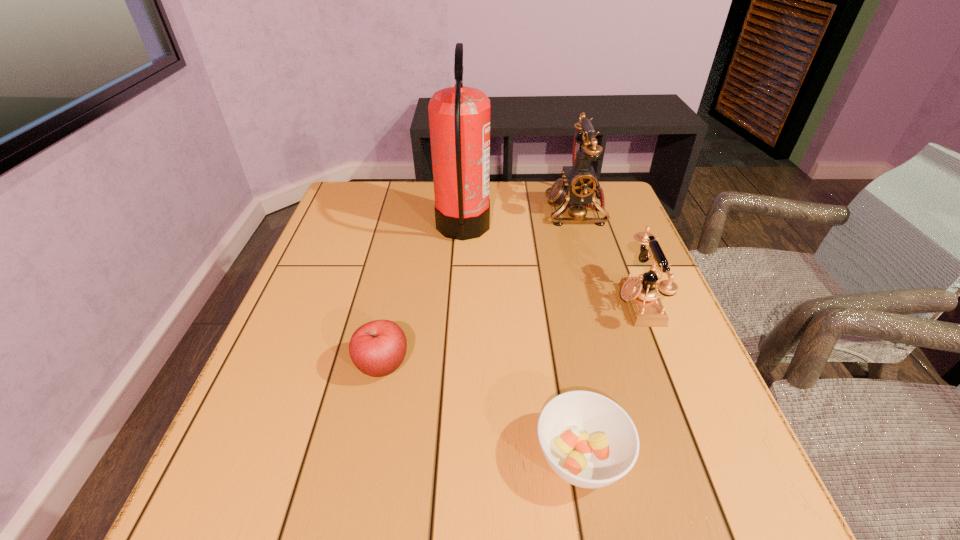
Identify the location of vacant area that lies between the apple and the tallest object. (422, 297).

The width and height of the screenshot is (960, 540). I want to click on unoccupied position between the fire extinguisher and the shortest object, so click(x=522, y=342).

This screenshot has width=960, height=540. I want to click on vacant space that's between the fourth shortest object and the soup bowl, so click(578, 333).

The height and width of the screenshot is (540, 960). Identify the location of vacant area that lies between the third nearest object and the apple. (511, 335).

At what (x,y) coordinates should I click in order to perform the action: click on empty space that is in between the fourth farthest object and the fourth shortest object. Please return your answer as a coordinate pair (x, y). Looking at the image, I should click on (479, 288).

This screenshot has width=960, height=540. I want to click on vacant space that is in between the fire extinguisher and the second nearest object, so click(x=422, y=297).

Find the location of a particular element. The height and width of the screenshot is (540, 960). vacant space that's between the farther telephone and the shortest object is located at coordinates (578, 333).

The image size is (960, 540). I want to click on empty location between the third nearest object and the farther telephone, so click(607, 256).

Find the location of `vacant space that is in between the second shortest object and the shorter telephone`. vacant space that is in between the second shortest object and the shorter telephone is located at coordinates (511, 335).

Image resolution: width=960 pixels, height=540 pixels. Find the location of `empty location between the fourth shortest object and the fire extinguisher`. empty location between the fourth shortest object and the fire extinguisher is located at coordinates (519, 219).